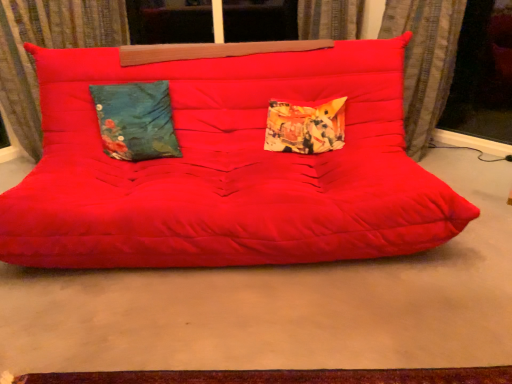
Where is `vacant point to the right of textured fabric curtain at right, the first curtain in the right-to-left sequence`? The width and height of the screenshot is (512, 384). vacant point to the right of textured fabric curtain at right, the first curtain in the right-to-left sequence is located at coordinates (462, 157).